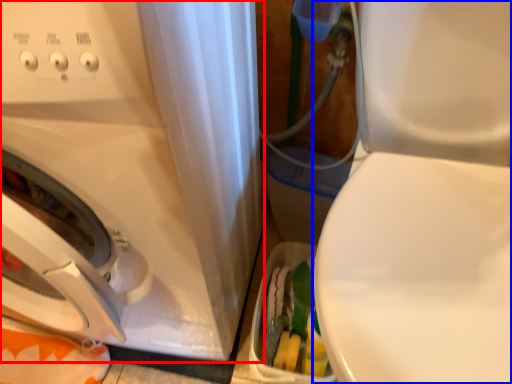
Question: Among these objects, which one is farthest to the camera, washing machine (highlighted by a red box) or machine (highlighted by a blue box)?

Choices:
 (A) washing machine
 (B) machine

Answer: (A)